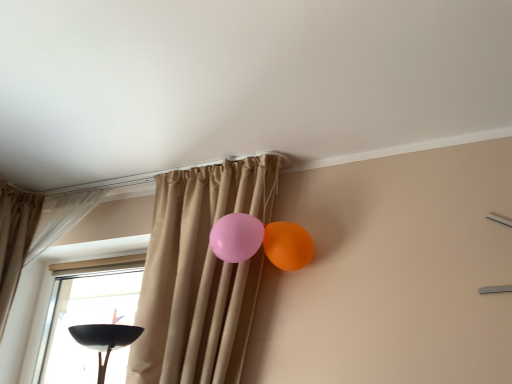
Question: From the image's perspective, is beige fabric curtain at upper left, which appears as the 2th curtain when viewed from the right, over beige fabric curtain at center, acting as the 1th curtain starting from the right?

Choices:
 (A) no
 (B) yes

Answer: (B)

Question: Are beige fabric curtain at upper left, the 1th curtain positioned from the left, and beige fabric curtain at center, acting as the 1th curtain starting from the right, located far from each other?

Choices:
 (A) yes
 (B) no

Answer: (B)

Question: Is beige fabric curtain at upper left, the 1th curtain positioned from the left, not inside beige fabric curtain at center, marked as the second curtain in a left-to-right arrangement?

Choices:
 (A) yes
 (B) no

Answer: (A)

Question: Is beige fabric curtain at upper left, the 1th curtain positioned from the left, bigger than beige fabric curtain at center, acting as the 1th curtain starting from the right?

Choices:
 (A) yes
 (B) no

Answer: (B)

Question: From a real-world perspective, is beige fabric curtain at upper left, which appears as the 2th curtain when viewed from the right, positioned under beige fabric curtain at center, marked as the second curtain in a left-to-right arrangement, based on gravity?

Choices:
 (A) yes
 (B) no

Answer: (B)

Question: From a real-world perspective, relative to beige fabric curtain at center, acting as the 1th curtain starting from the right, is orange glossy balloon at upper right vertically above or below?

Choices:
 (A) above
 (B) below

Answer: (A)

Question: Is point (290, 264) closer or farther from the camera than point (233, 322)?

Choices:
 (A) farther
 (B) closer

Answer: (A)

Question: Is orange glossy balloon at upper right taller or shorter than beige fabric curtain at center, acting as the 1th curtain starting from the right?

Choices:
 (A) tall
 (B) short

Answer: (B)

Question: Considering the relative positions of orange glossy balloon at upper right and beige fabric curtain at center, marked as the second curtain in a left-to-right arrangement, in the image provided, is orange glossy balloon at upper right to the left or to the right of beige fabric curtain at center, marked as the second curtain in a left-to-right arrangement,?

Choices:
 (A) left
 (B) right

Answer: (B)

Question: Which is correct: beige fabric curtain at center, acting as the 1th curtain starting from the right, is inside orange glossy balloon at upper right, or outside of it?

Choices:
 (A) inside
 (B) outside

Answer: (B)

Question: Is point (233, 340) closer or farther from the camera than point (276, 261)?

Choices:
 (A) closer
 (B) farther

Answer: (A)

Question: Considering their positions, is beige fabric curtain at center, marked as the second curtain in a left-to-right arrangement, located in front of or behind orange glossy balloon at upper right?

Choices:
 (A) front
 (B) behind

Answer: (A)

Question: Visually, is beige fabric curtain at center, acting as the 1th curtain starting from the right, positioned to the left or to the right of orange glossy balloon at upper right?

Choices:
 (A) left
 (B) right

Answer: (A)

Question: Is orange glossy balloon at upper right to the left or to the right of beige fabric curtain at upper left, the 1th curtain positioned from the left, in the image?

Choices:
 (A) right
 (B) left

Answer: (A)

Question: From their relative heights in the image, would you say orange glossy balloon at upper right is taller or shorter than beige fabric curtain at upper left, which appears as the 2th curtain when viewed from the right?

Choices:
 (A) tall
 (B) short

Answer: (B)